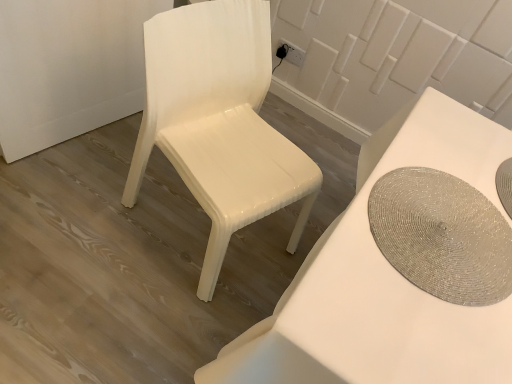
What are the coordinates of `vacant space underneath white glossy chair at left (from a real-world perspective)` in the screenshot? It's located at (186, 227).